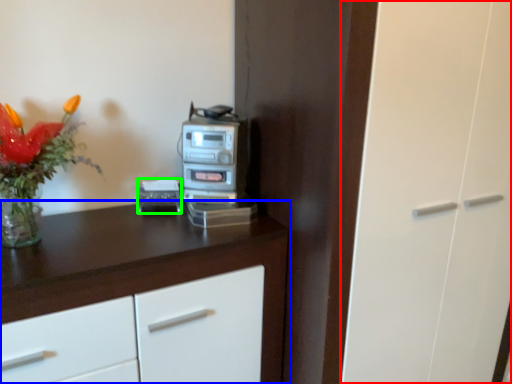
Question: Based on their relative distances, which object is nearer to glass door (highlighted by a red box)? Choose from cabinetry (highlighted by a blue box) and appliance (highlighted by a green box).

Choices:
 (A) cabinetry
 (B) appliance

Answer: (A)